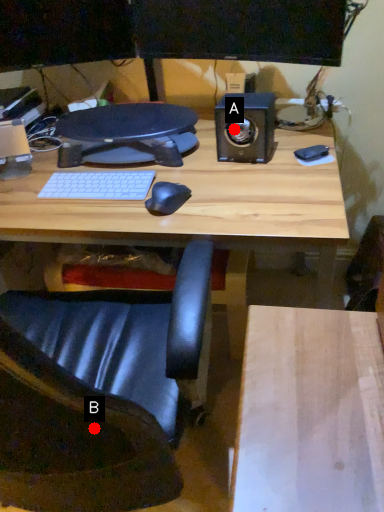
Question: Two points are circled on the image, labeled by A and B beside each circle. Which point is farther from the camera taking this photo?

Choices:
 (A) A is further
 (B) B is further

Answer: (A)